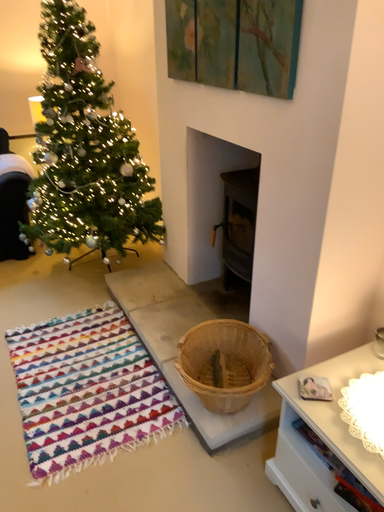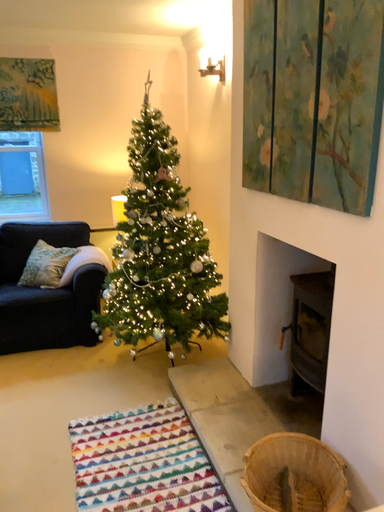
Question: Which way did the camera rotate in the video?

Choices:
 (A) rotated downward
 (B) rotated upward

Answer: (B)